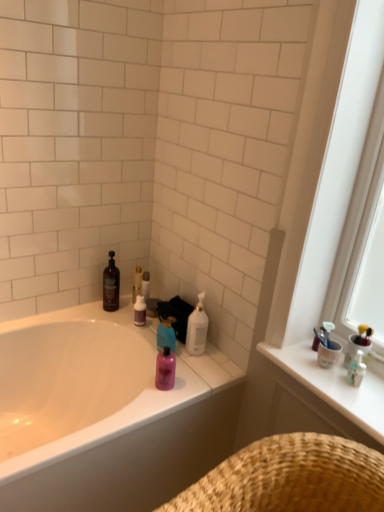
Image resolution: width=384 pixels, height=512 pixels. In order to click on unoccupied region to the right of pink glossy bottle at center, the second toiletry viewed from the back in this screenshot , I will do `click(197, 379)`.